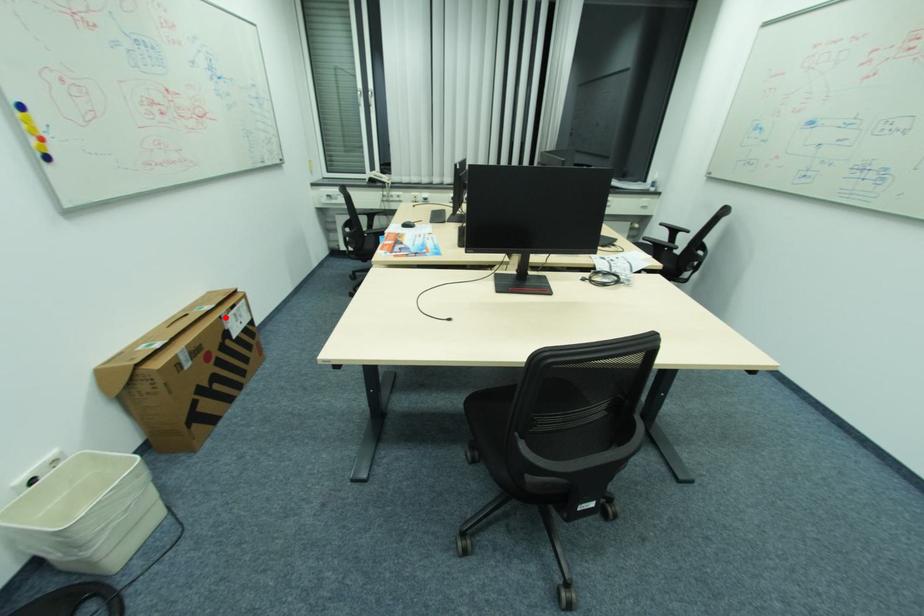
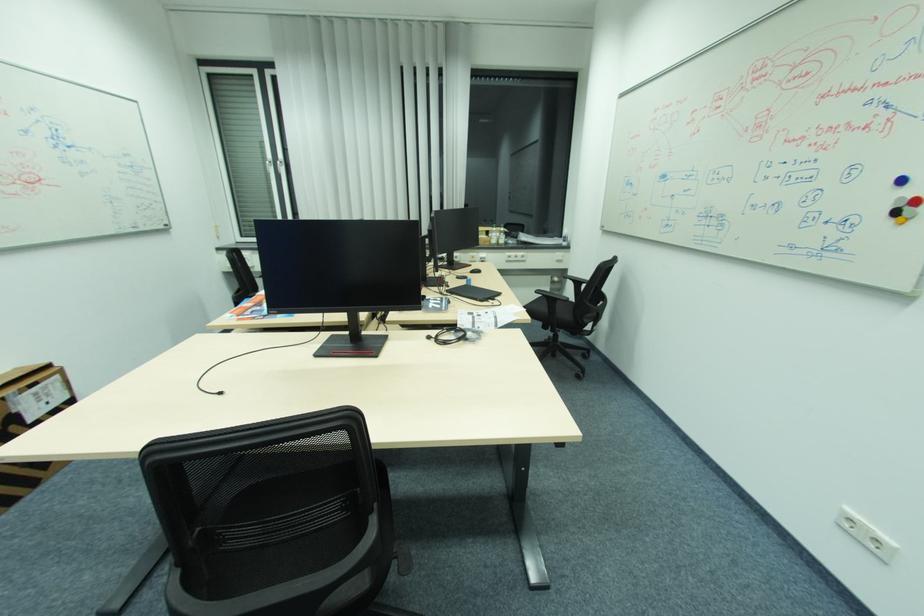
The point at the highlighted location is marked in the first image. Where is the corresponding point in the second image?

(7, 399)